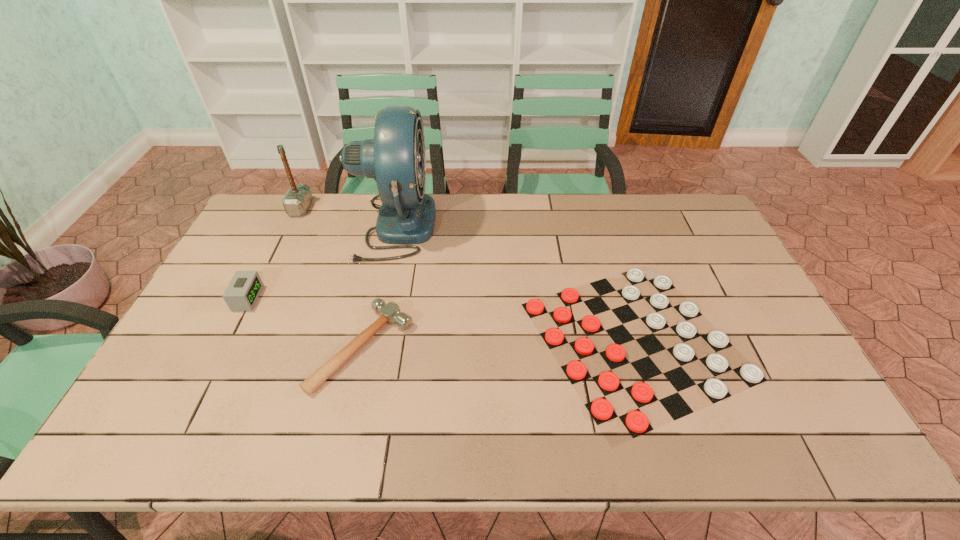
Identify the location of object that is positioned at the near right corner. This screenshot has width=960, height=540. [x=601, y=410].

In the image, there is a desktop. Where is `vacant space at the far edge`? This screenshot has width=960, height=540. vacant space at the far edge is located at coordinates (585, 193).

This screenshot has width=960, height=540. In the image, there is a desktop. Identify the location of vacant space at the near edge. (270, 418).

Image resolution: width=960 pixels, height=540 pixels. In the image, there is a desktop. In order to click on vacant space at the right edge in this screenshot , I will do `click(726, 275)`.

In the image, there is a desktop. Where is `blank space at the near left corner`? blank space at the near left corner is located at coordinates coord(130,430).

The height and width of the screenshot is (540, 960). In order to click on vacant space at the far right corner of the desktop in this screenshot , I will do `click(696, 219)`.

This screenshot has width=960, height=540. Find the location of `empty space that is in between the tallest object and the alarm clock`. empty space that is in between the tallest object and the alarm clock is located at coordinates (321, 262).

The height and width of the screenshot is (540, 960). Find the location of `empty location between the alarm clock and the taller hammer`. empty location between the alarm clock and the taller hammer is located at coordinates (275, 253).

Locate an element on the screen. free space between the shortest object and the farther hammer is located at coordinates (468, 274).

I want to click on free space between the checkerboard and the right hammer, so click(x=499, y=343).